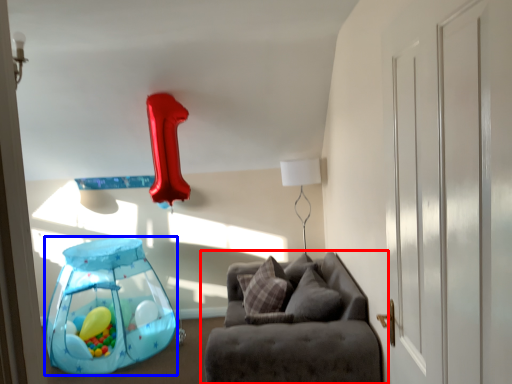
Question: Which of the following is the closest to the observer, studio couch (highlighted by a red box) or balloon (highlighted by a blue box)?

Choices:
 (A) studio couch
 (B) balloon

Answer: (A)